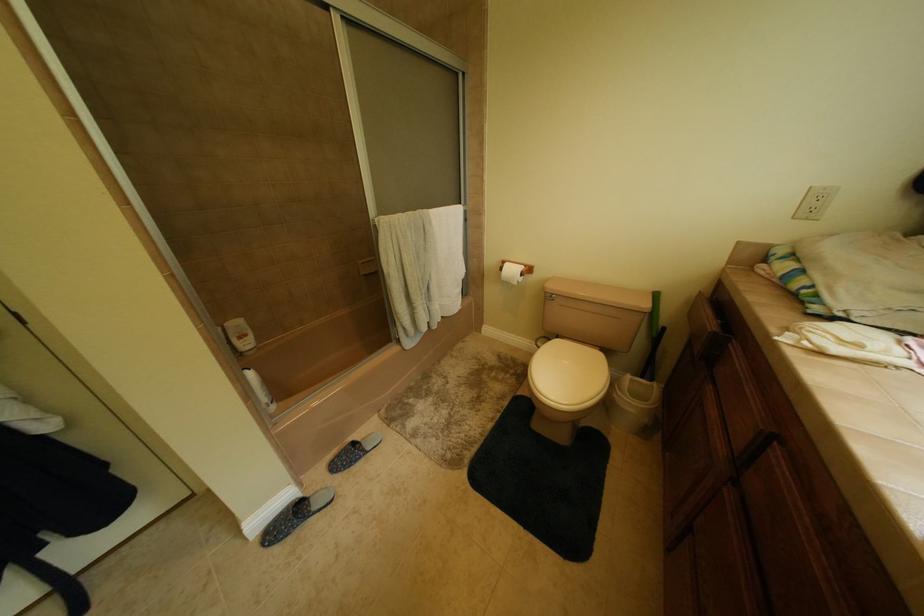
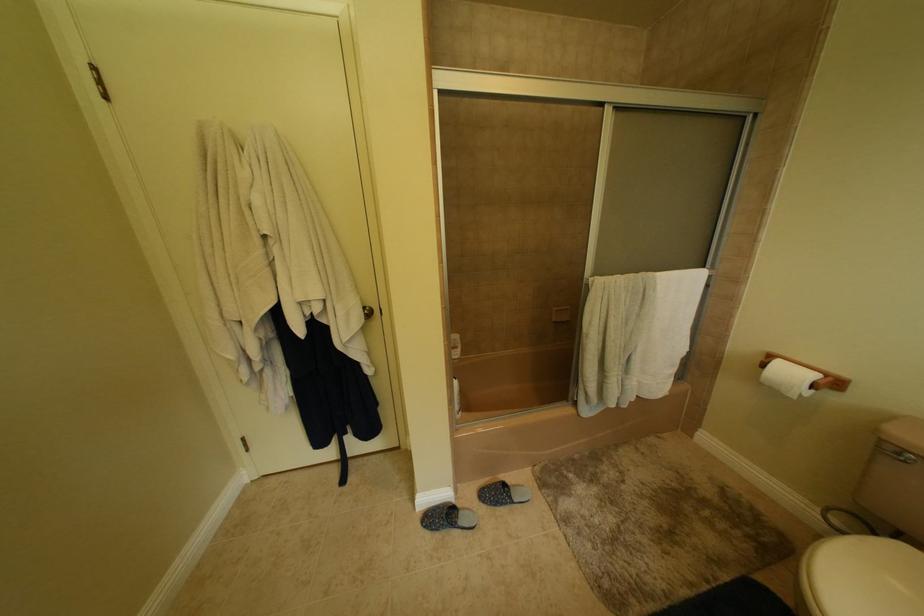
Question: The images are taken continuously from a first-person perspective. In which direction is your viewpoint rotating?

Choices:
 (A) Left
 (B) Right
 (C) Up
 (D) Down

Answer: (A)